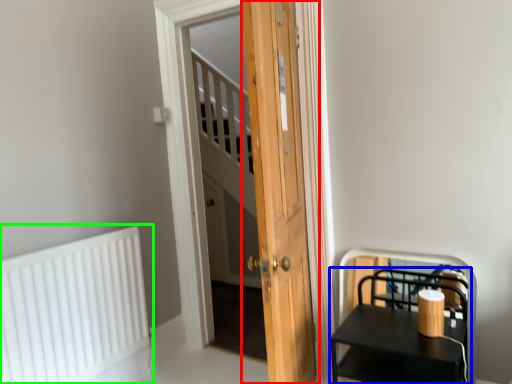
Question: Which object is positioned closest to door (highlighted by a red box)? Select from furniture (highlighted by a blue box) and radiator (highlighted by a green box).

Choices:
 (A) furniture
 (B) radiator

Answer: (A)